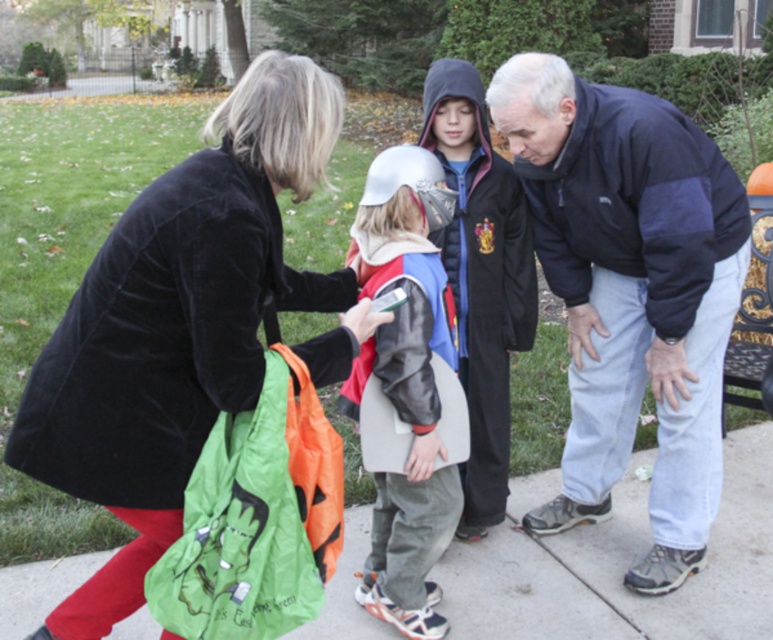
The image size is (773, 640). Describe the element at coordinates (618, 563) in the screenshot. I see `concrete sidewalk at lower center` at that location.

Is concrete sidewalk at lower center smaller than leather jacket at center?

Actually, concrete sidewalk at lower center might be larger than leather jacket at center.

Between point (717, 566) and point (428, 522), which one is positioned behind?

The point (717, 566) is behind.

I want to click on concrete sidewalk at lower center, so click(618, 563).

Is dark blue fleece jacket at center wider than leather jacket at center?

Indeed, dark blue fleece jacket at center has a greater width compared to leather jacket at center.

Measure the distance between dark blue fleece jacket at center and camera.

8.36 feet

Is point (705, 401) positioned in front of point (419, 349)?

No, it is behind (419, 349).

Locate an element on the screen. Image resolution: width=773 pixels, height=640 pixels. dark blue fleece jacket at center is located at coordinates (630, 292).

Consider the image. Is velvet black coat at center positioned at the back of dark blue fleece jacket at center?

No, velvet black coat at center is in front of dark blue fleece jacket at center.

Does velvet black coat at center have a larger size compared to dark blue fleece jacket at center?

Indeed, velvet black coat at center has a larger size compared to dark blue fleece jacket at center.

Does point (162, 472) lie in front of point (707, 212)?

Yes, it is in front of point (707, 212).

The width and height of the screenshot is (773, 640). Find the location of `velvet black coat at center`. velvet black coat at center is located at coordinates (182, 324).